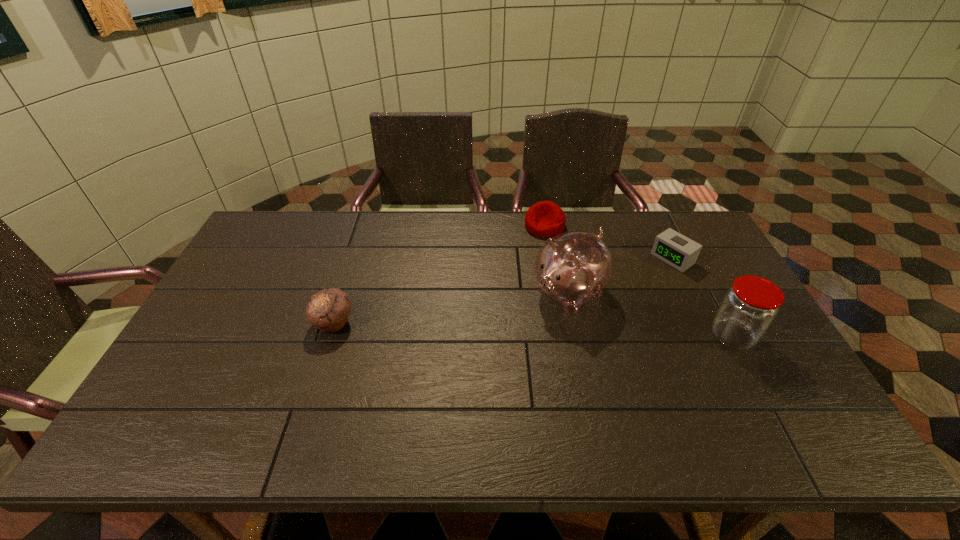
The width and height of the screenshot is (960, 540). Identify the location of the leftmost object. (328, 309).

You are a GUI agent. You are given a task and a screenshot of the screen. Output one action in this format:
    pyautogui.click(x=<x>, y=<y>)
    Task: Click on the muffin
    The image size is (960, 540).
    Given the screenshot: What is the action you would take?
    pyautogui.click(x=328, y=309)

The height and width of the screenshot is (540, 960). Find the location of `the second tallest object`. the second tallest object is located at coordinates (748, 309).

You are a GUI agent. You are given a task and a screenshot of the screen. Output one action in this format:
    pyautogui.click(x=<x>, y=<y>)
    Task: Click on the beanbag
    
    Given the screenshot: What is the action you would take?
    pyautogui.click(x=544, y=219)

Find the location of a particular element. The image size is (960, 540). the tallest object is located at coordinates (573, 267).

Find the location of a particular element. The width and height of the screenshot is (960, 540). alarm clock is located at coordinates (675, 249).

The height and width of the screenshot is (540, 960). In order to click on vacant region located on the left of the muffin in this screenshot , I will do (277, 323).

You are a GUI agent. You are given a task and a screenshot of the screen. Output one action in this format:
    pyautogui.click(x=<x>, y=<y>)
    Task: Click on the vacant area located 0.080m on the front of the fourth shortest object
    This screenshot has height=540, width=960.
    Given the screenshot: What is the action you would take?
    pyautogui.click(x=756, y=380)

Identify the location of free space located 0.400m on the seat area of the farthest object. This screenshot has height=540, width=960. (504, 319).

Find the location of a particular element. Image resolution: width=960 pixels, height=540 pixels. blank space located on the seat area of the farthest object is located at coordinates 507,312.